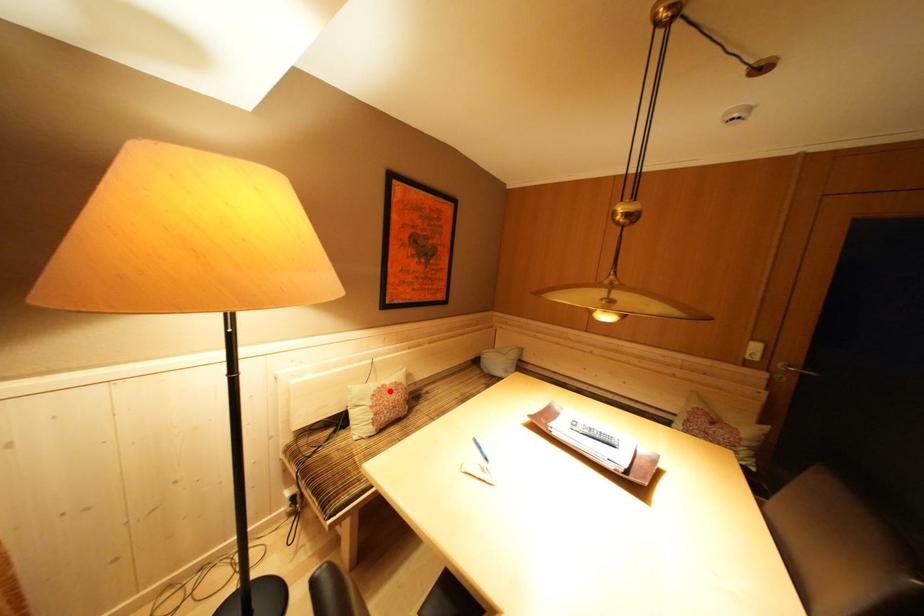
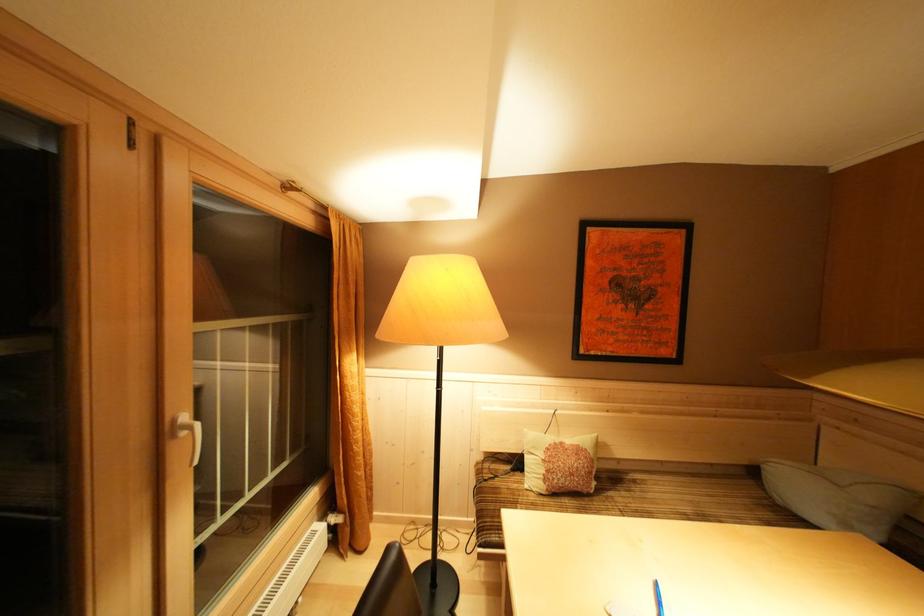
Where in the second image is the point corresponding to the highlighted location from the first image?

(568, 448)